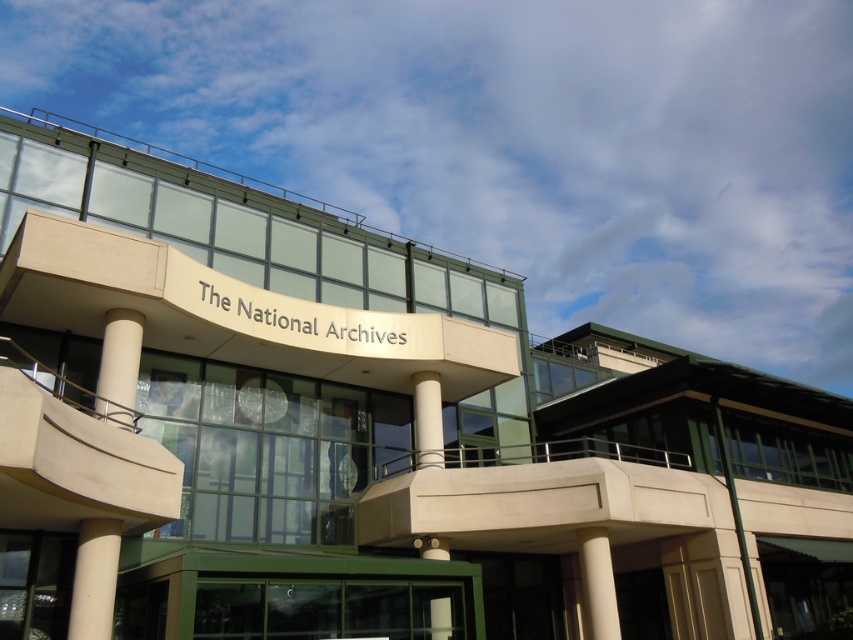
Does white smooth pillar at lower left appear on the left side of white smooth column at lower right?

Yes, white smooth pillar at lower left is to the left of white smooth column at lower right.

Is white smooth pillar at lower left bigger than white smooth column at lower right?

No.

Who is more distant from viewer, (x=79, y=605) or (x=608, y=570)?

Point (x=608, y=570)

Find the location of a particular element. The height and width of the screenshot is (640, 853). white smooth pillar at lower left is located at coordinates (94, 579).

Does white smooth column at lower right have a smaller size compared to white glossy column at center?

Yes.

Is point (607, 560) positioned in front of point (421, 412)?

That is True.

Between point (593, 541) and point (416, 413), which one is positioned in front?

Point (593, 541) is more forward.

This screenshot has height=640, width=853. In order to click on white smooth column at lower right in this screenshot , I will do `click(596, 584)`.

Who is positioned more to the right, white smooth column at left or white glossy pillar at center?

white glossy pillar at center is more to the right.

Who is more forward, (113, 520) or (135, 417)?

Point (113, 520) is more forward.

Locate an element on the screen. This screenshot has width=853, height=640. white smooth column at left is located at coordinates (94, 579).